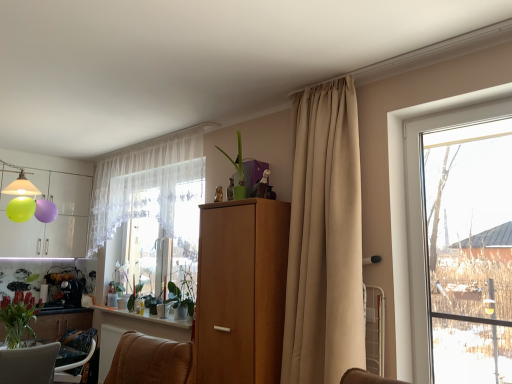
The width and height of the screenshot is (512, 384). In order to click on empty space that is ontop of transparent glass window at right (from a real-world perspective) in this screenshot , I will do `click(452, 107)`.